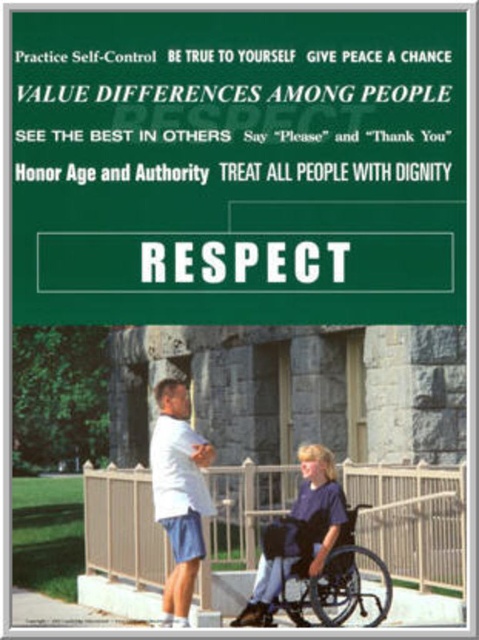
You are a person who needs to choose between the blue fabric wheelchair at lower center and the black plastic wheelchair at lower center based on their positions. Which wheelchair is placed higher?

The blue fabric wheelchair at lower center is located above the black plastic wheelchair at lower center, so the blue fabric wheelchair at lower center is placed higher.

You are a person who uses a wheelchair and wants to park closer to the entrance of the stone building. Which wheelchair, the blue fabric wheelchair at lower center or the black plastic wheelchair at lower center, is positioned closer to the entrance?

The blue fabric wheelchair at lower center is positioned closer to the entrance because it is further to the viewer than the black plastic wheelchair at lower center, meaning it is nearer to the entrance.

You are a visitor at a public park and see the green paper sign at center and the blue fabric wheelchair at lower center. According to the principles listed on the sign, which object should you prioritize respecting to ensure accessibility for others?

The blue fabric wheelchair at lower center should be prioritized for respect as it ensures accessibility, aligning with the principle of treating all people with dignity from the green paper sign at center.